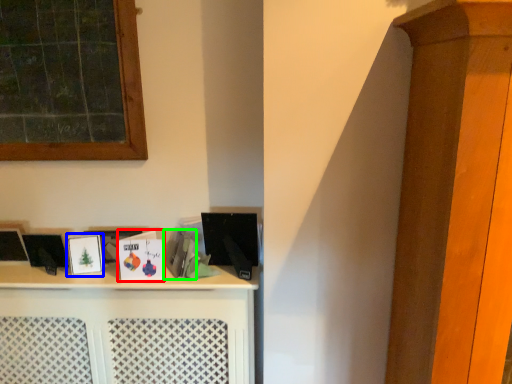
Question: Which is nearer to the book (highlighted by a red box)? picture frame (highlighted by a blue box) or book (highlighted by a green box).

Choices:
 (A) picture frame
 (B) book

Answer: (B)